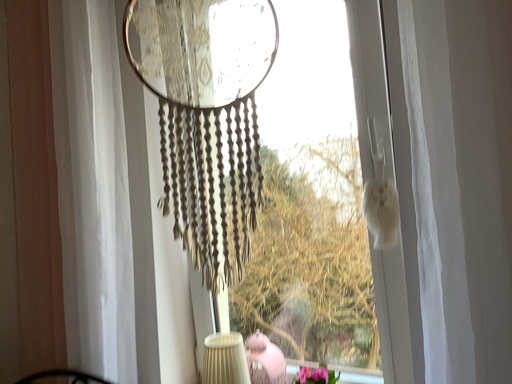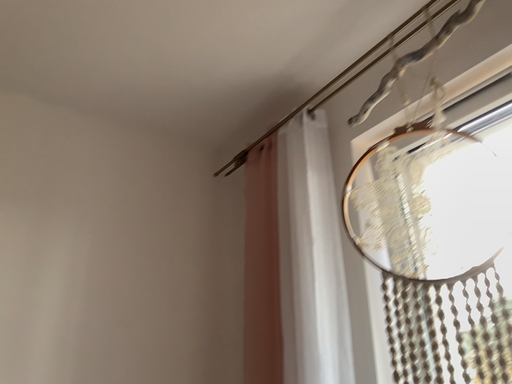
Question: How did the camera likely rotate when shooting the video?

Choices:
 (A) rotated right
 (B) rotated left

Answer: (B)